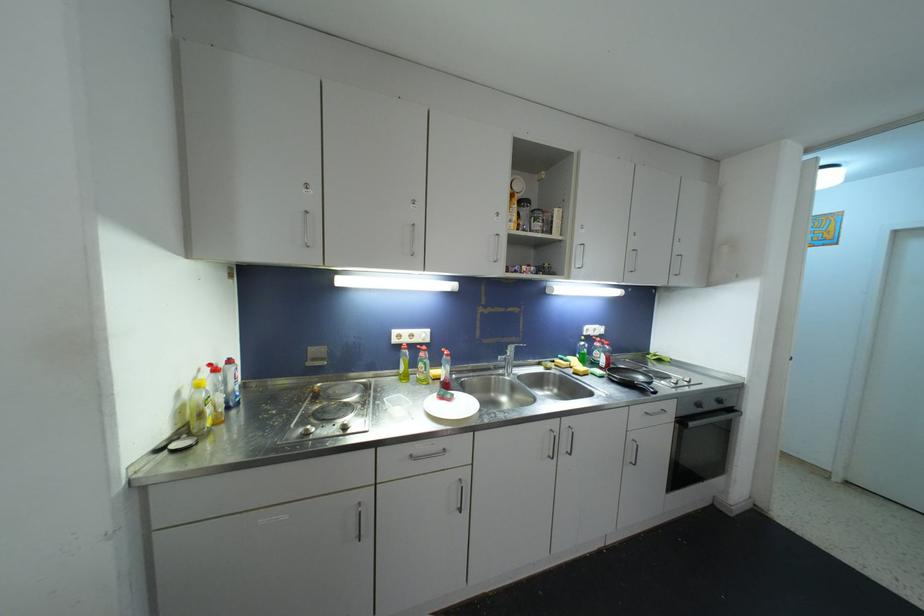
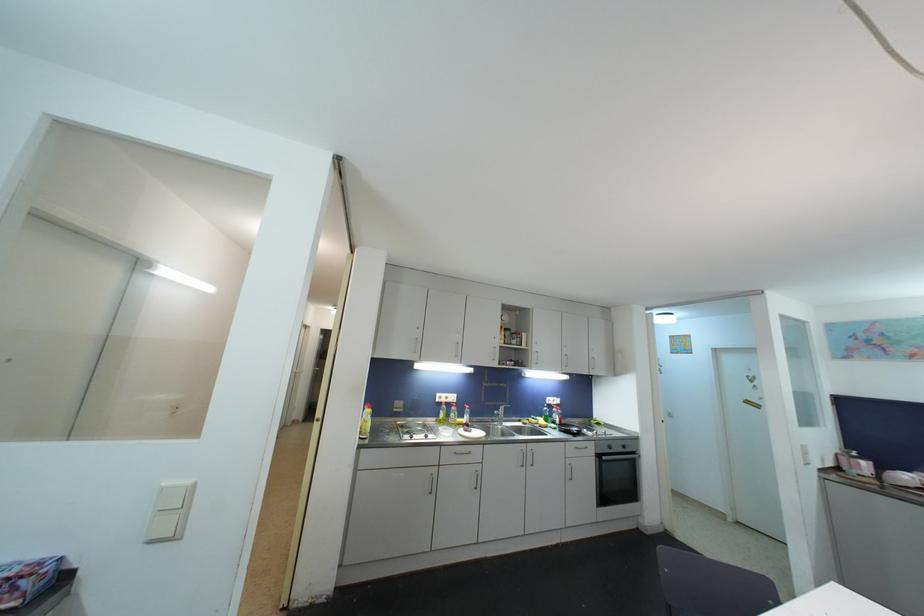
In the second image, find the point that corresponds to (x=633, y=440) in the first image.

(570, 464)